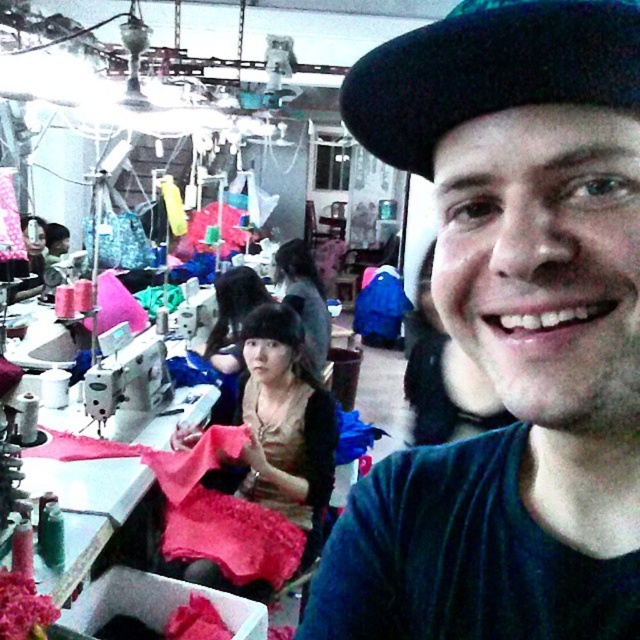
You are a photographer trying to capture a closeup of the man in the dark green T shirt. You notice two hats at the top of the image, a black matte hat at upper center and a black felt hat at upper center. Which hat is bigger in size?

The black matte hat at upper center is larger in size compared to the black felt hat at upper center.

You are standing in the garment factory scene. You need to locate the black matte hat at upper center. Where exactly is it positioned in the image?

The black matte hat at upper center is located at point coordinates of 0.520 on the x axis and 0.797 on the y axis.